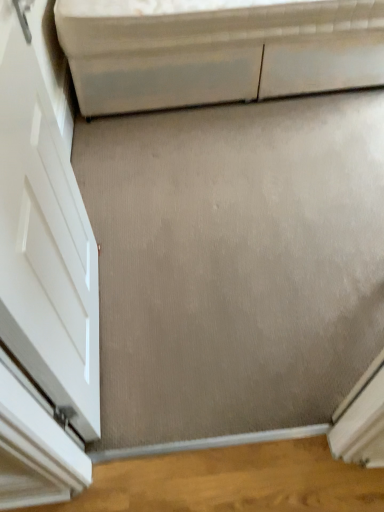
Question: Is white glossy door at left not close to white glossy cabinet at upper center?

Choices:
 (A) no
 (B) yes

Answer: (B)

Question: Is white glossy door at left in front of white glossy cabinet at upper center?

Choices:
 (A) no
 (B) yes

Answer: (B)

Question: Does white glossy door at left turn towards white glossy cabinet at upper center?

Choices:
 (A) yes
 (B) no

Answer: (B)

Question: Is white glossy door at left beside white glossy cabinet at upper center?

Choices:
 (A) no
 (B) yes

Answer: (A)

Question: Can you confirm if white glossy door at left is positioned to the left of white glossy cabinet at upper center?

Choices:
 (A) no
 (B) yes

Answer: (B)

Question: Is white glossy door at left positioned beyond the bounds of white glossy cabinet at upper center?

Choices:
 (A) no
 (B) yes

Answer: (B)

Question: From a real-world perspective, is white glossy cabinet at upper center under white glossy door at left?

Choices:
 (A) yes
 (B) no

Answer: (A)

Question: Is white glossy cabinet at upper center placed right next to white glossy door at left?

Choices:
 (A) no
 (B) yes

Answer: (A)

Question: Considering the relative sizes of white glossy cabinet at upper center and white glossy door at left in the image provided, is white glossy cabinet at upper center wider than white glossy door at left?

Choices:
 (A) yes
 (B) no

Answer: (A)

Question: Can you confirm if white glossy cabinet at upper center is positioned to the left of white glossy door at left?

Choices:
 (A) yes
 (B) no

Answer: (B)

Question: Considering the relative positions of white glossy cabinet at upper center and white glossy door at left in the image provided, is white glossy cabinet at upper center behind white glossy door at left?

Choices:
 (A) no
 (B) yes

Answer: (B)

Question: Is white glossy cabinet at upper center positioned before white glossy door at left?

Choices:
 (A) yes
 (B) no

Answer: (B)

Question: Visually, is white glossy door at left positioned to the left or to the right of white glossy cabinet at upper center?

Choices:
 (A) left
 (B) right

Answer: (A)